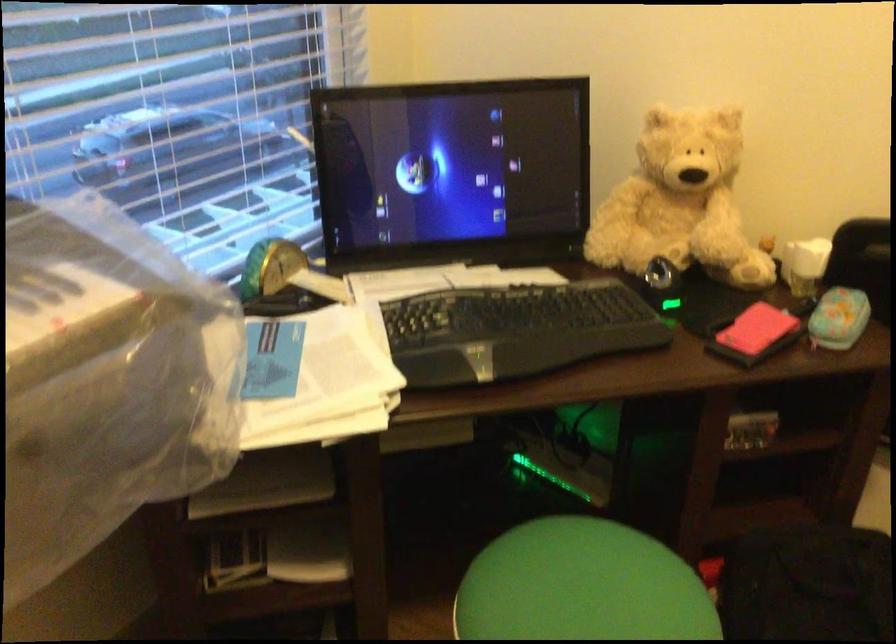
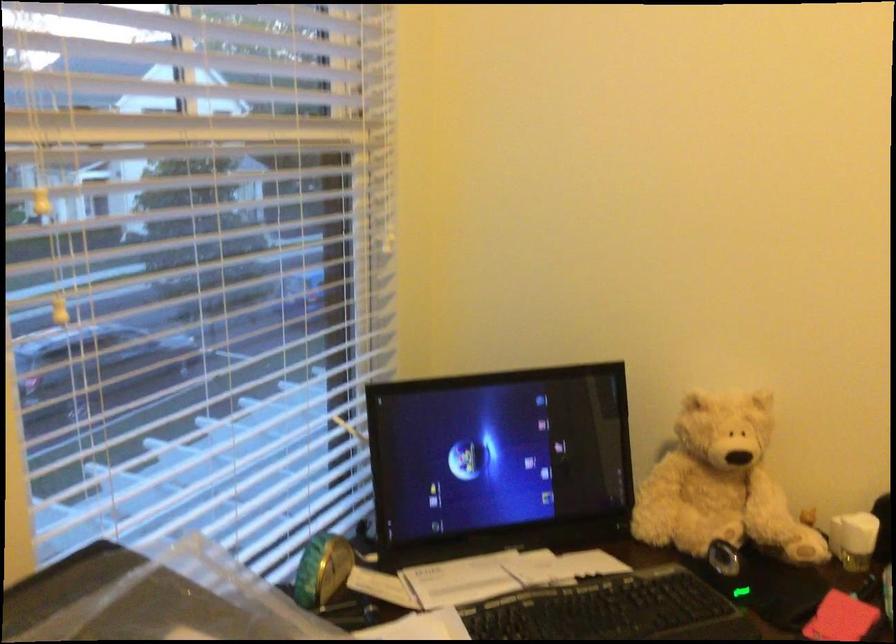
Question: The images are taken continuously from a first-person perspective. In which direction are you moving?

Choices:
 (A) Left
 (B) Right
 (C) Forward
 (D) Backward

Answer: (A)